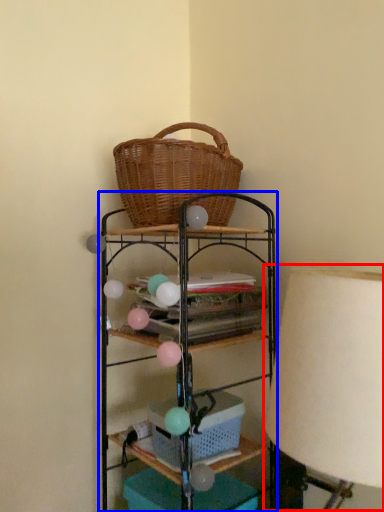
Question: Which of the following is the farthest to the observer, table lamp (highlighted by a red box) or shelf (highlighted by a blue box)?

Choices:
 (A) table lamp
 (B) shelf

Answer: (B)